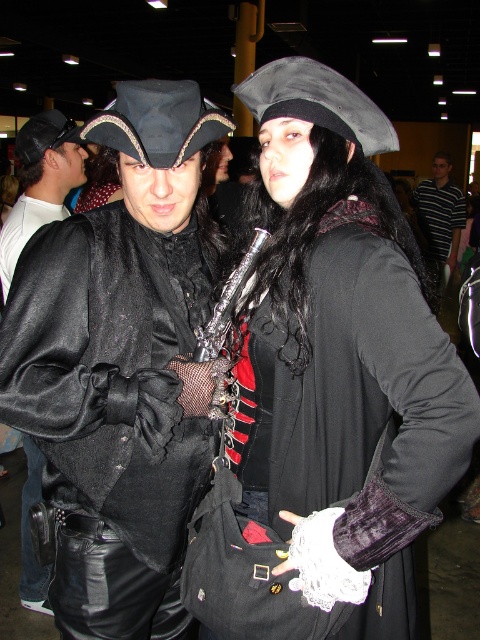
You are a costume designer observing the two individuals in the scene. Both are wearing coats at the center. Which coat is taller, the matte black coat at center or the velvet black coat at center?

The matte black coat at center is taller than the velvet black coat at center according to the description.

You are organizing a costume party and need to ensure that all clothing items fit properly. Given the descriptions of the matte black jacket at left and the striped cotton shirt at center, which clothing item would you recommend for someone with a smaller frame?

The matte black jacket at left is smaller than the striped cotton shirt at center, so it would be more suitable for someone with a smaller frame.